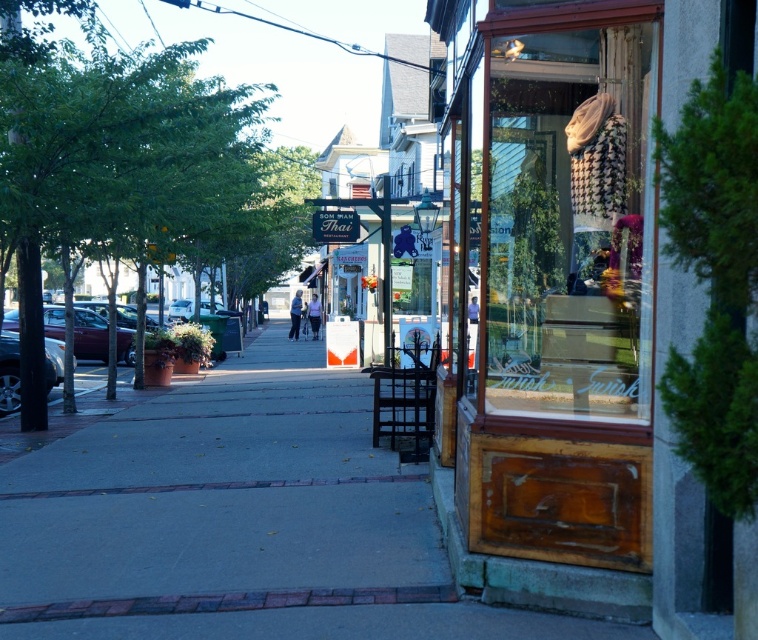
You are a delivery person who needs to unload a large package from your truck. The wooden display case at center is blocking the path to the shiny maroon sedan at left. Can you move the display case to access the sedan?

The wooden display case at center is in front of the shiny maroon sedan at left, so moving the display case would allow access to the sedan.